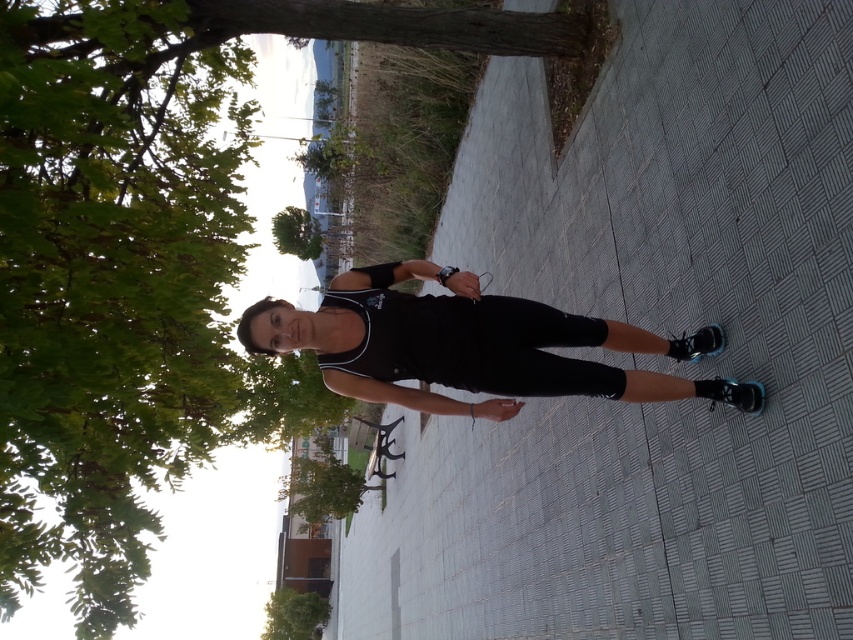
Question: Which point is farther to the camera?

Choices:
 (A) (451, 317)
 (B) (86, 435)

Answer: (B)

Question: Is black matte tank top at center below green leafy tree at lower left?

Choices:
 (A) no
 (B) yes

Answer: (A)

Question: Can you confirm if green leafy tree at upper left is positioned above black matte tank top at center?

Choices:
 (A) no
 (B) yes

Answer: (B)

Question: Does green leafy tree at upper left have a greater width compared to black matte tank top at center?

Choices:
 (A) no
 (B) yes

Answer: (B)

Question: Which object is positioned closest to the green leafy tree at lower left?

Choices:
 (A) green leafy tree at upper left
 (B) black matte tank top at center

Answer: (A)

Question: Considering the real-world distances, which object is closest to the green leafy tree at lower left?

Choices:
 (A) black matte tank top at center
 (B) green leafy tree at upper left

Answer: (B)